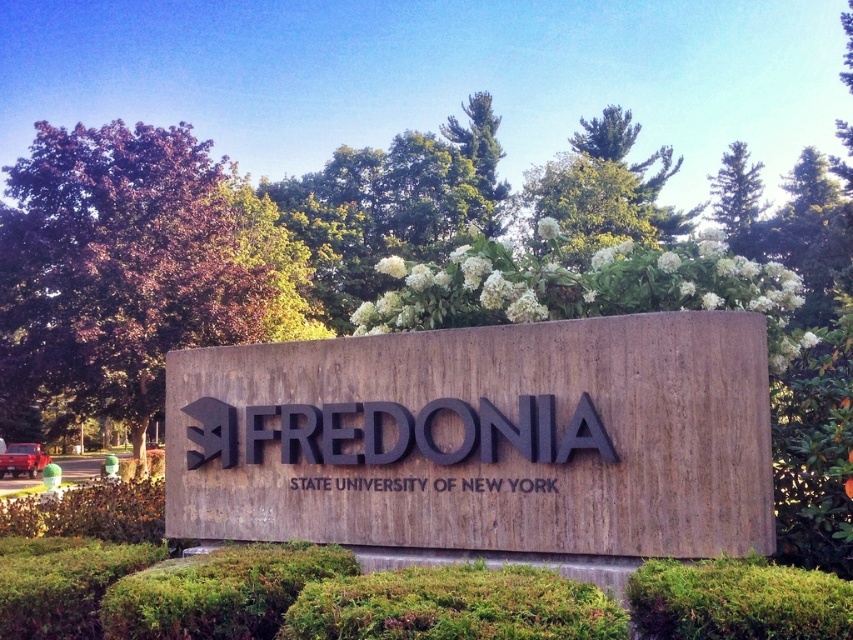
Question: Does black concrete sign at center come behind black matte sign at center?

Choices:
 (A) yes
 (B) no

Answer: (B)

Question: From the image, what is the correct spatial relationship of black concrete sign at center in relation to black matte sign at center?

Choices:
 (A) right
 (B) left

Answer: (A)

Question: Is black concrete sign at center below black matte sign at center?

Choices:
 (A) yes
 (B) no

Answer: (A)

Question: Which of the following is the farthest from the observer?

Choices:
 (A) (250, 454)
 (B) (483, 356)

Answer: (A)

Question: Which object appears farthest from the camera in this image?

Choices:
 (A) black matte sign at center
 (B) black concrete sign at center

Answer: (A)